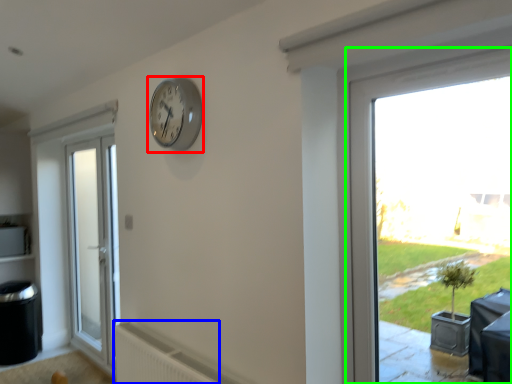
Question: Which is nearer to the clock (highlighted by a red box)? radiator (highlighted by a blue box) or window (highlighted by a green box).

Choices:
 (A) radiator
 (B) window

Answer: (B)